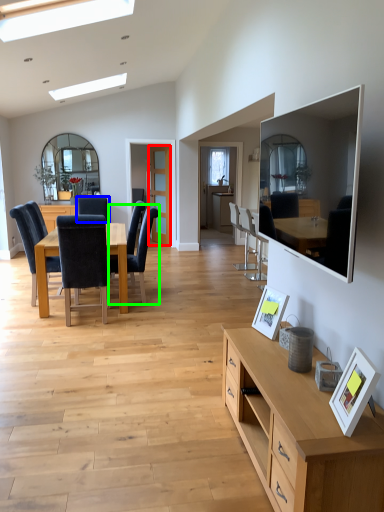
Question: Which is nearer to the glass door (highlighted by a red box)? chair (highlighted by a blue box) or chair (highlighted by a green box).

Choices:
 (A) chair
 (B) chair

Answer: (A)